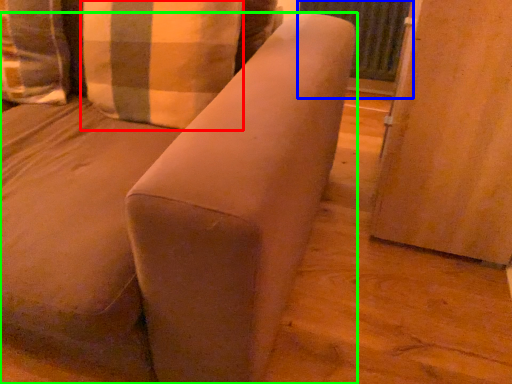
Question: Which object is the closest to the pillow (highlighted by a red box)? Choose among these: screen door (highlighted by a blue box) or furniture (highlighted by a green box).

Choices:
 (A) screen door
 (B) furniture

Answer: (B)